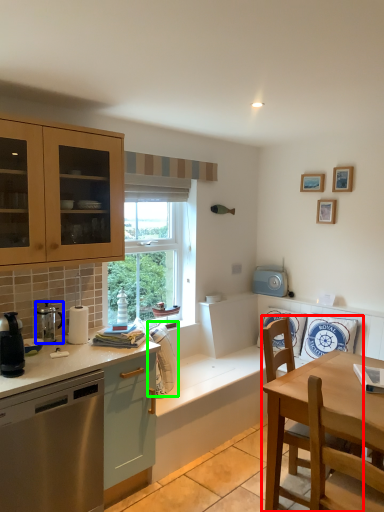
Question: Which object is positioned closest to chair (highlighted by a red box)? Select from kitchen appliance (highlighted by a blue box) and appliance (highlighted by a green box).

Choices:
 (A) kitchen appliance
 (B) appliance

Answer: (B)